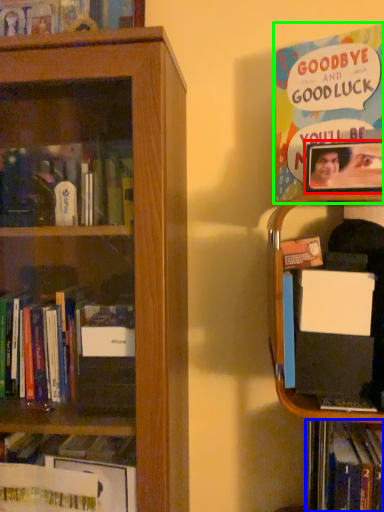
Question: Which is nearer to the picture frame (highlighted by a red box)? book (highlighted by a blue box) or book (highlighted by a green box).

Choices:
 (A) book
 (B) book

Answer: (B)